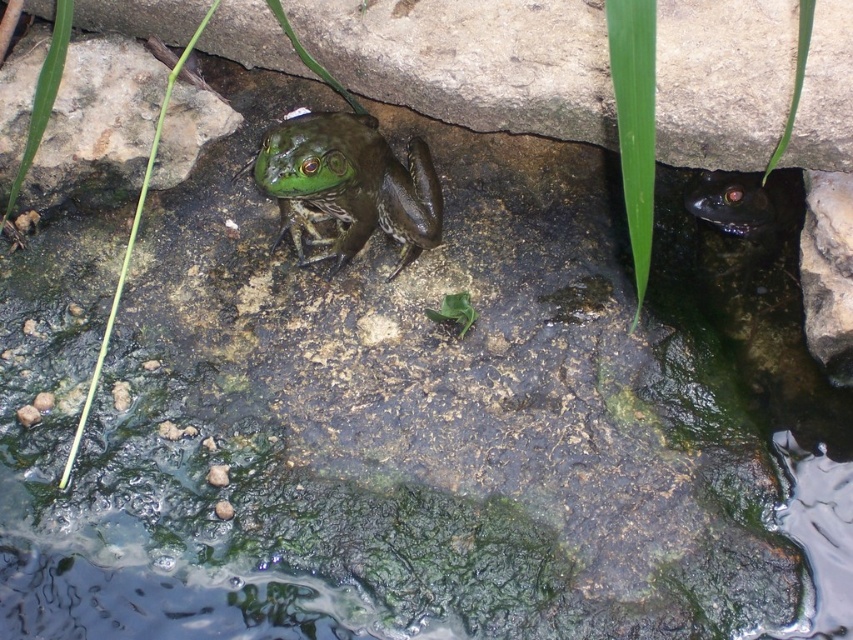
Question: Which of the following is the closest to the observer?

Choices:
 (A) (656, 108)
 (B) (102, 72)
 (C) (254, 176)

Answer: (A)

Question: Where is green rough stone at center located in relation to green matte/frothy frog at center in the image?

Choices:
 (A) above
 (B) below

Answer: (A)

Question: Which of the following is the farthest from the observer?

Choices:
 (A) (149, 182)
 (B) (448, 36)

Answer: (A)

Question: Is green rough stone at upper center further to camera compared to green matte/frothy frog at center?

Choices:
 (A) yes
 (B) no

Answer: (A)

Question: Which point is farther from the camera taking this photo?

Choices:
 (A) (355, 17)
 (B) (62, 198)
 (C) (347, 138)

Answer: (B)

Question: Observing the image, what is the correct spatial positioning of green rough stone at upper center in reference to green matte/frothy frog at center?

Choices:
 (A) above
 (B) below

Answer: (A)